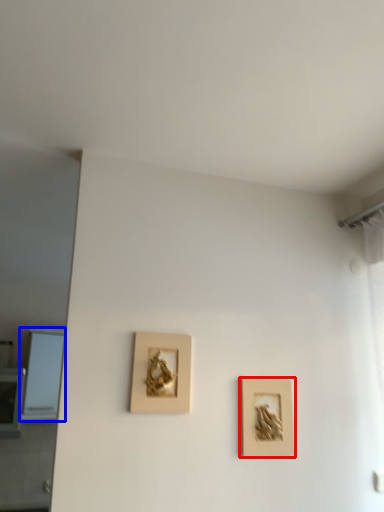
Question: Which point is further to the camera, picture frame (highlighted by a red box) or window (highlighted by a blue box)?

Choices:
 (A) picture frame
 (B) window

Answer: (B)